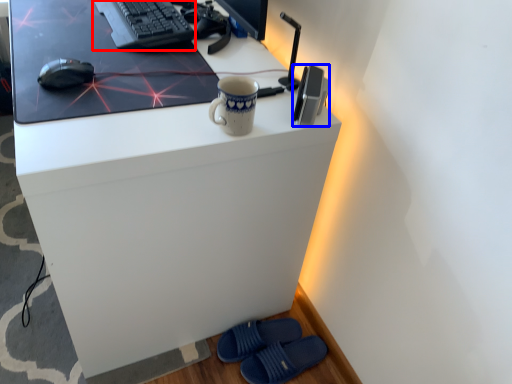
Question: Among these objects, which one is farthest to the camera, computer keyboard (highlighted by a red box) or gadget (highlighted by a blue box)?

Choices:
 (A) computer keyboard
 (B) gadget

Answer: (A)